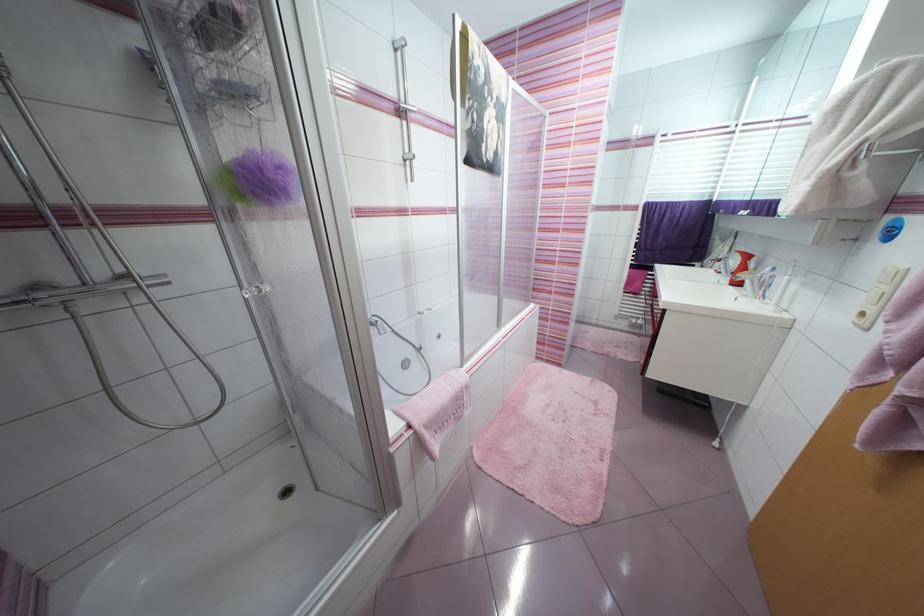
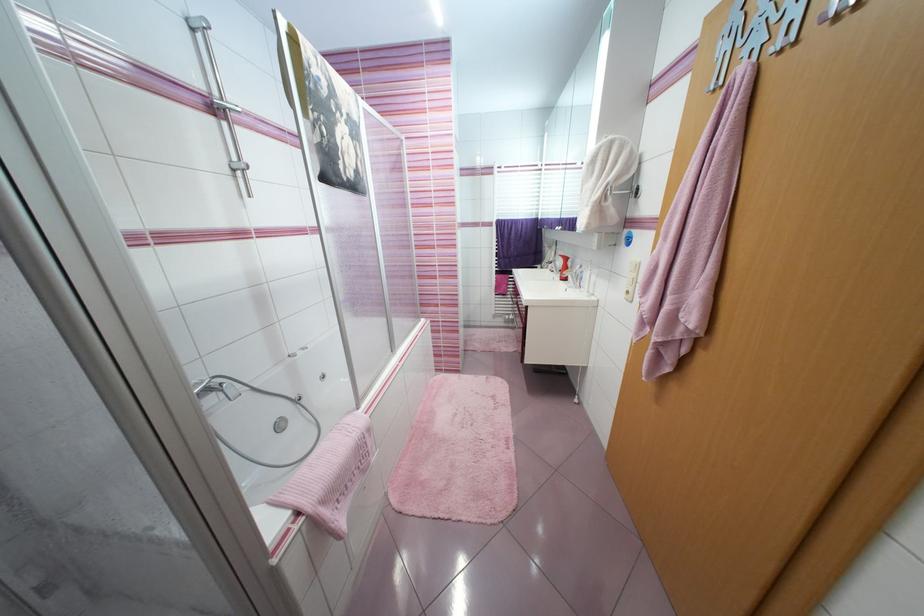
In the second image, find the point that corresponds to point 400,52 in the first image.

(198, 31)